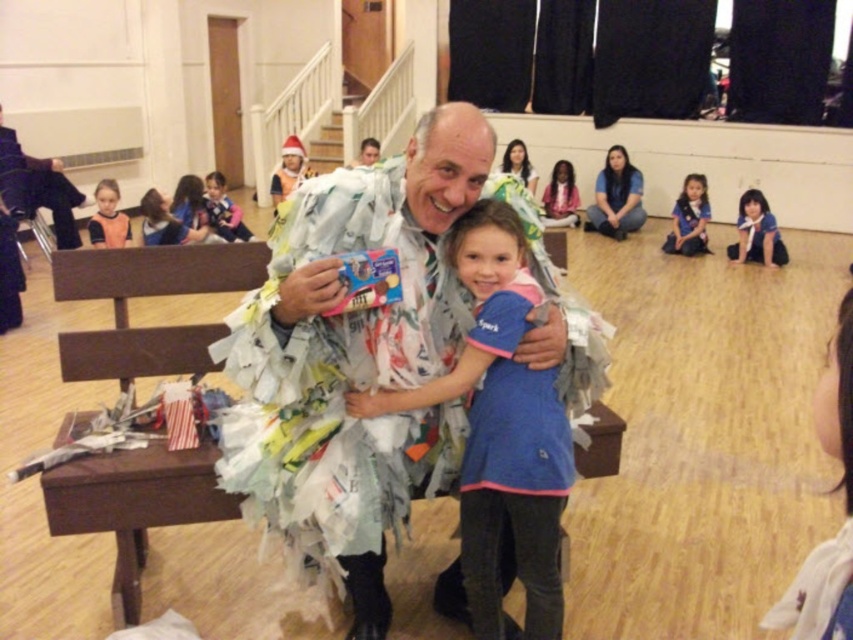
Question: Can you confirm if matte black jacket at upper left is positioned to the left of matte white shirt at center?

Choices:
 (A) yes
 (B) no

Answer: (A)

Question: Can you confirm if matte black jacket at upper left is positioned above blue uniform at center?

Choices:
 (A) yes
 (B) no

Answer: (A)

Question: Which point is farther from the camera taking this photo?

Choices:
 (A) (708, 205)
 (B) (218, 467)
 (C) (218, 195)

Answer: (A)

Question: Which point appears closest to the camera in this image?

Choices:
 (A) (76, 240)
 (B) (189, 477)
 (C) (221, 426)
 (D) (223, 216)

Answer: (B)

Question: Which point is farther to the camera?

Choices:
 (A) (73, 198)
 (B) (166, 360)
 (C) (216, 230)

Answer: (C)

Question: From the image, what is the correct spatial relationship of blue uniform at center in relation to smooth pink shirt at center?

Choices:
 (A) below
 (B) above

Answer: (A)